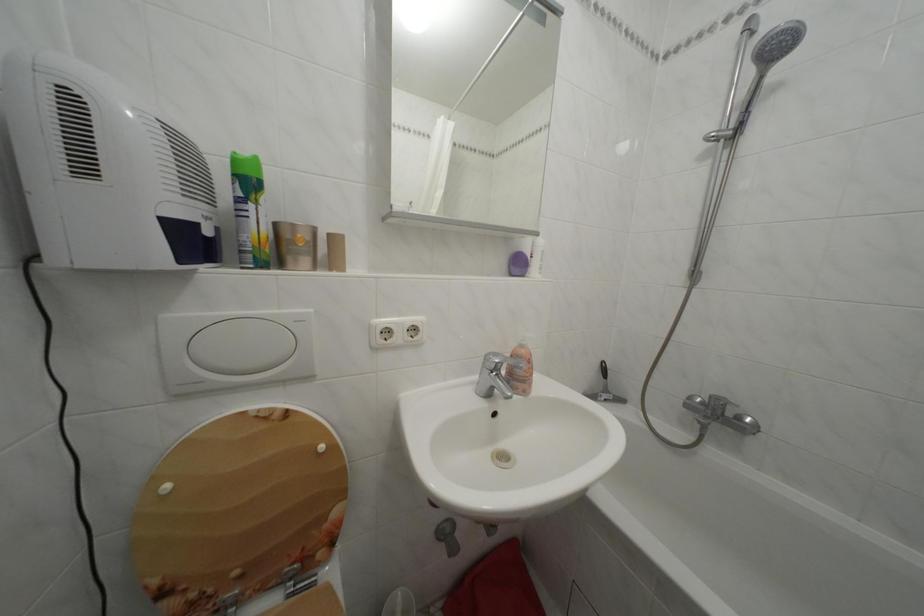
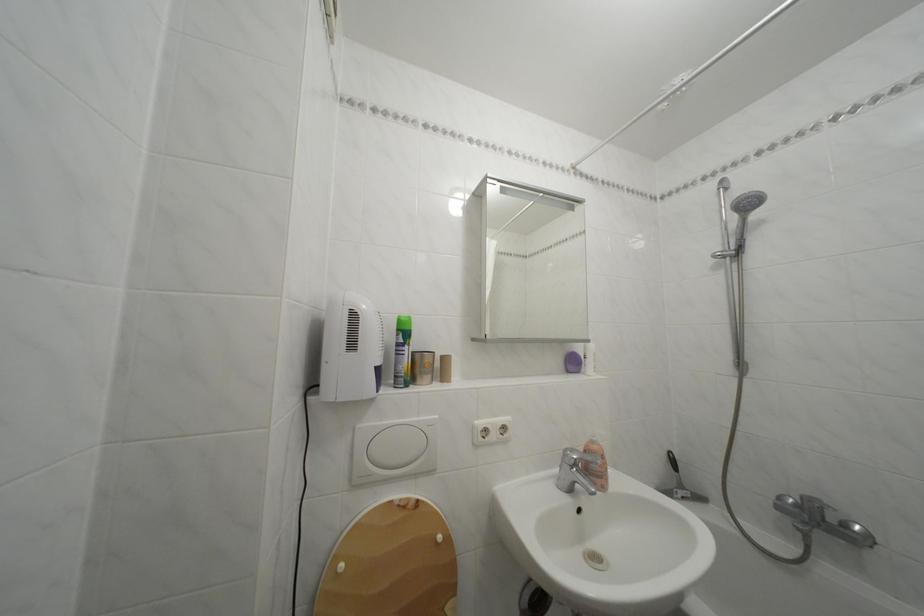
Find the pixel in the second image that matches pixel 505 361 in the first image.

(581, 456)